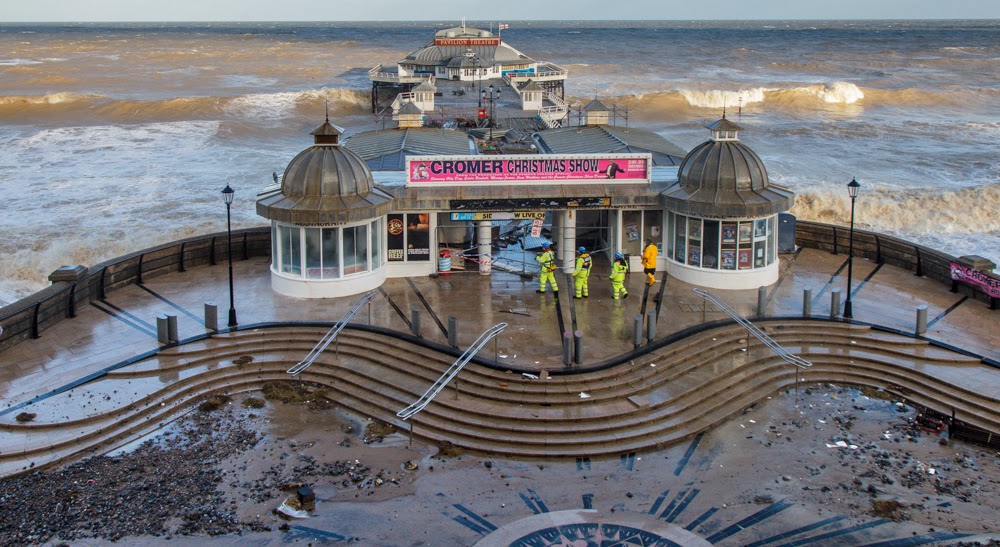
You are a GUI agent. You are given a task and a screenshot of the screen. Output one action in this format:
    pyautogui.click(x=<x>, y=<y>)
    Task: Click on the cylindrical booths
    This screenshot has height=547, width=1000.
    Given the screenshot: What is the action you would take?
    pyautogui.click(x=320, y=171), pyautogui.click(x=754, y=183)